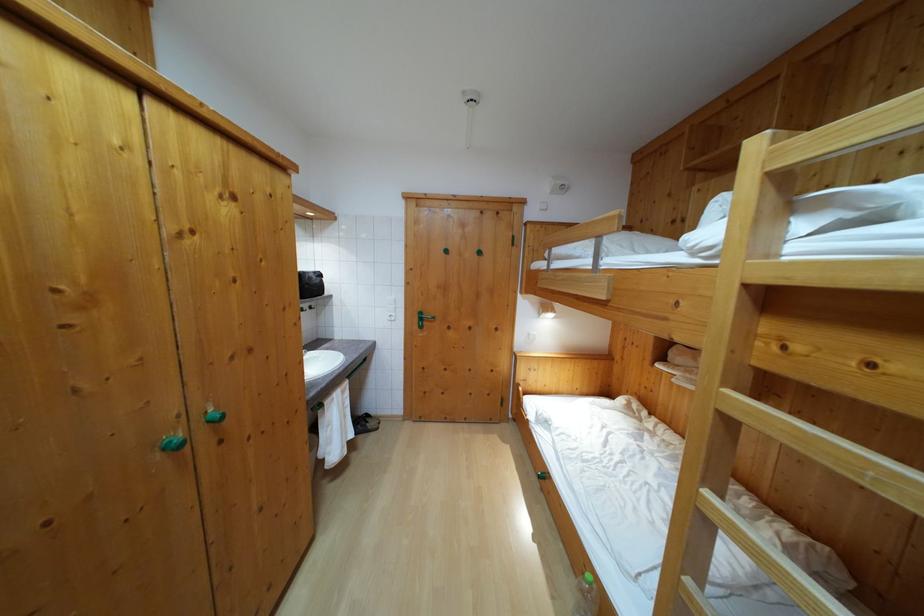
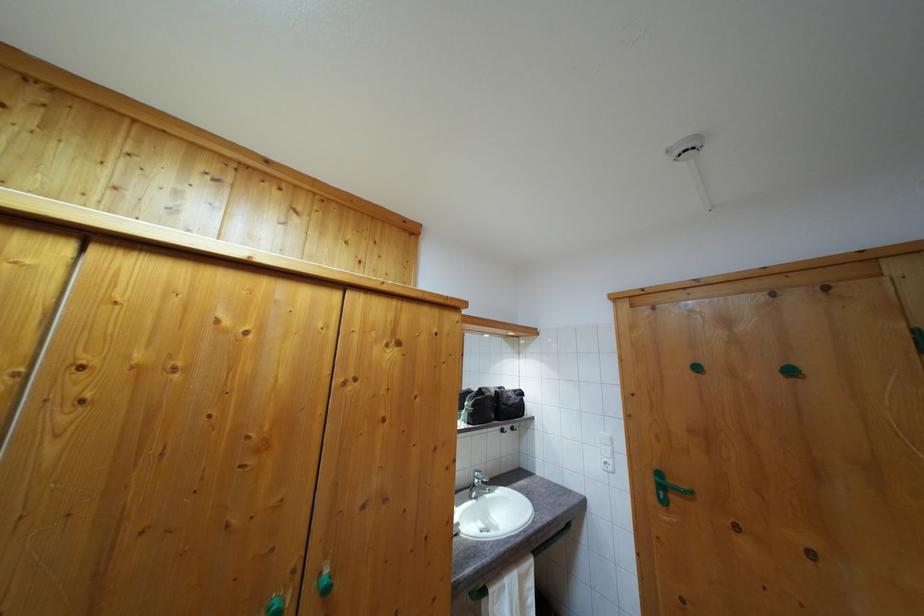
The point at (396, 314) is marked in the first image. Where is the corresponding point in the second image?

(613, 456)